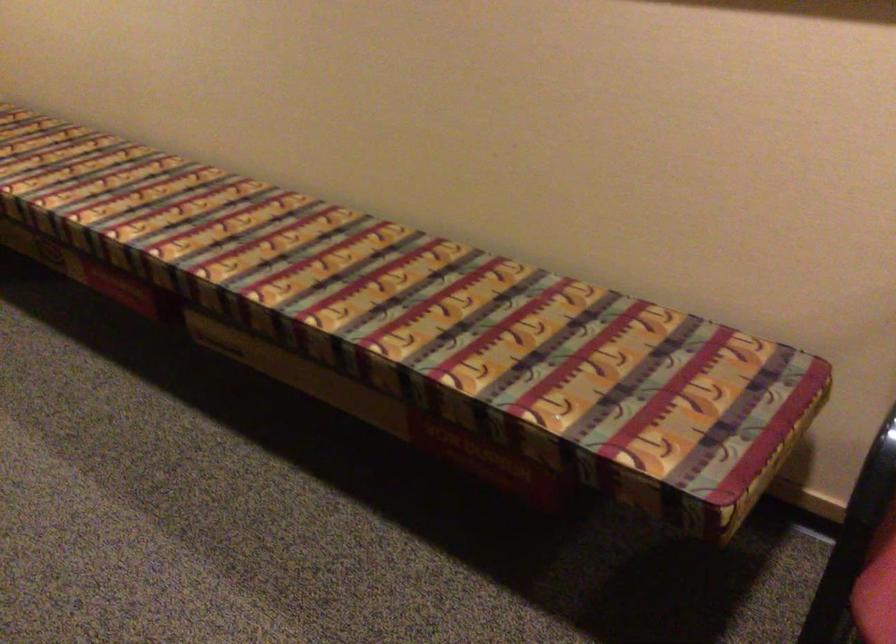
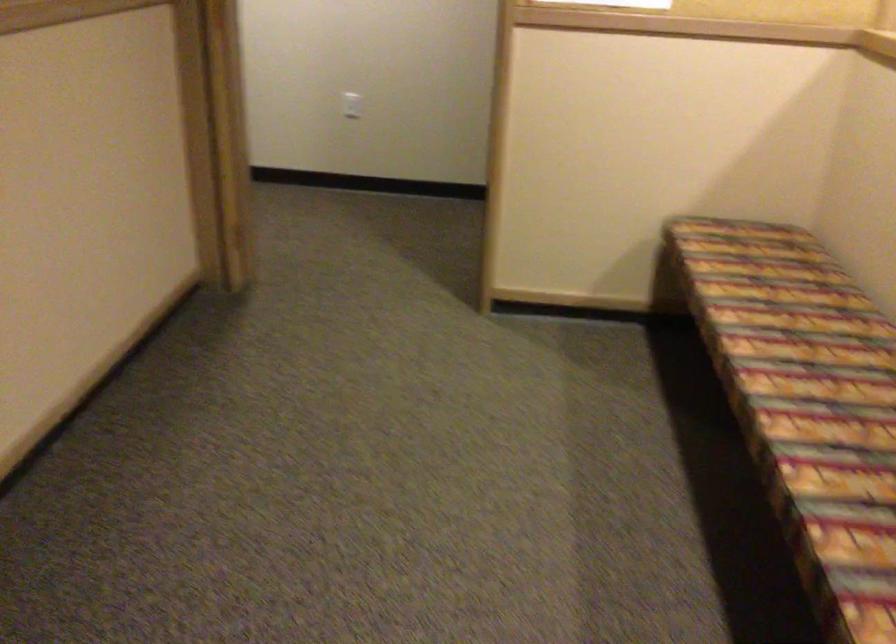
Question: Based on the continuous images, in which direction is the camera rotating? Reply with the corresponding letter.

Choices:
 (A) Left
 (B) Right
 (C) Up
 (D) Down

Answer: (A)